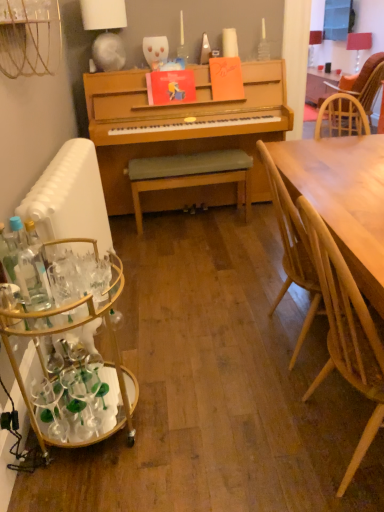
Question: In the image, is clear glass bottle at left, which appears as the second bottle when viewed from the left, positioned in front of or behind gray fabric bench at center?

Choices:
 (A) front
 (B) behind

Answer: (A)

Question: From a real-world perspective, is clear glass bottle at left, acting as the first bottle starting from the right, above or below gray fabric bench at center?

Choices:
 (A) above
 (B) below

Answer: (A)

Question: Which object is the farthest from the white metallic radiator at left?

Choices:
 (A) gray fabric bench at center
 (B) matte red book at center, arranged as the 1th book when viewed from the left
 (C) translucent glass bottle at left, the 1th bottle viewed from the left
 (D) white paper lampshade at upper left, the 1th lamp positioned from the left
 (E) matte white lampshade at upper right, the 2th lamp viewed from the left

Answer: (E)

Question: Estimate the real-world distances between objects in this image. Which object is farther from the matte white lampshade at upper right, the 2th lamp in the right-to-left sequence?

Choices:
 (A) gold metallic bar cart at left
 (B) gray fabric bench at center
 (C) light wood chair at right, which ranks as the 1th chair in front-to-back order
 (D) wooden woven chair at right, which is the first chair from top to bottom
 (E) matte red book at center, which is counted as the second book, starting from the right

Answer: (C)